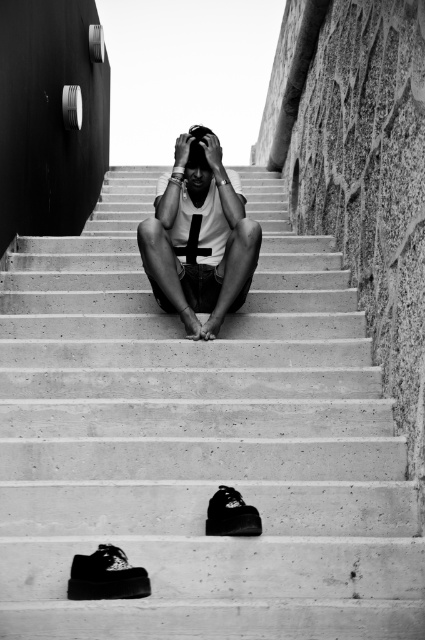
Question: From the image, what is the correct spatial relationship of white matte shirt at center in relation to black leather shoe at center?

Choices:
 (A) below
 (B) above

Answer: (B)

Question: Which point is closer to the camera?

Choices:
 (A) (124, 436)
 (B) (119, 552)
 (C) (215, 497)
 (D) (209, 314)

Answer: (B)

Question: Which of the following is the farthest from the observer?

Choices:
 (A) (141, 227)
 (B) (119, 560)
 (C) (206, 532)
 (D) (193, 131)

Answer: (D)

Question: Observing the image, what is the correct spatial positioning of concrete stairs at center in reference to smooth skin head at center?

Choices:
 (A) below
 (B) above

Answer: (A)

Question: Which of the following is the closest to the observer?

Choices:
 (A) smooth skin head at center
 (B) black leather shoe at center
 (C) concrete stairs at center

Answer: (B)

Question: Is white matte shirt at center behind black leather shoe at center?

Choices:
 (A) yes
 (B) no

Answer: (A)